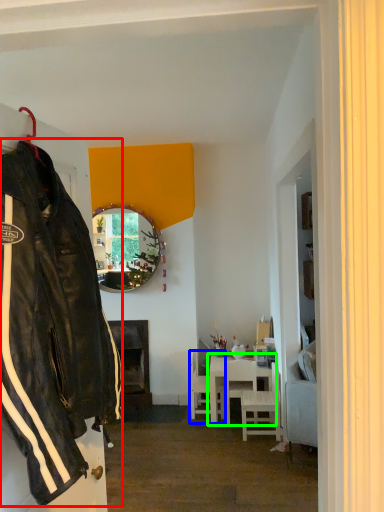
Question: Which object is positioned farthest from jacket (highlighted by a red box)? Select from chair (highlighted by a blue box) and table (highlighted by a green box).

Choices:
 (A) chair
 (B) table

Answer: (A)